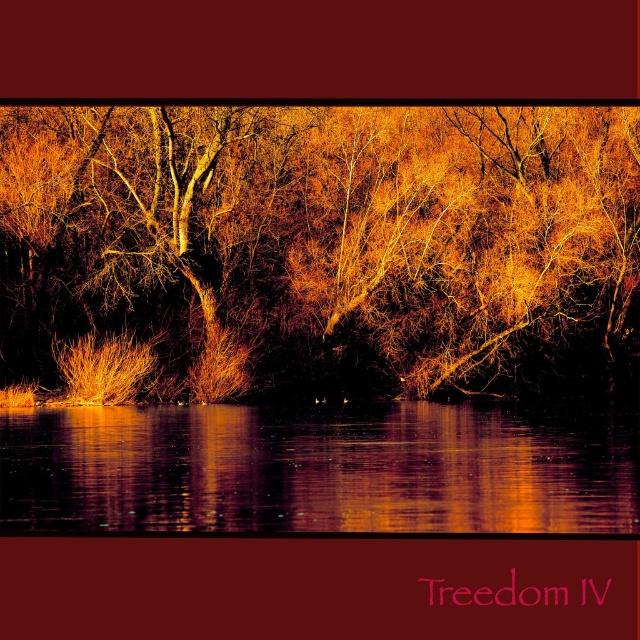
You are standing at the edge of the water in the autumnal scene. You see a point marked at coordinates (317, 250). What object does this point correspond to?

The point at coordinates (317, 250) corresponds to the golden textured tree at center.

You are standing on the shore of the lake and want to take a photo of the golden textured tree at center and the reflective water at center. Which object will appear closer to the camera in your photo?

The golden textured tree at center will appear closer to the camera in your photo because the reflective water at center is behind it.